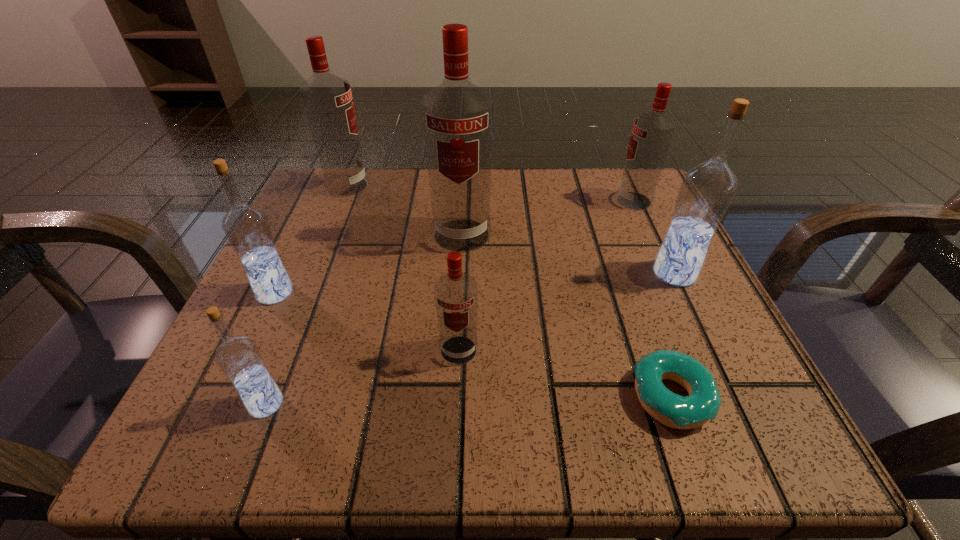
At what (x,y) coordinates should I click in order to perform the action: click on free space that satisfies the following two spatial constraints: 1. on the front label of the rightmost red vodka; 2. on the front label of the sixth nearest object. Please return your answer as a coordinate pair (x, y). The image size is (960, 540). Looking at the image, I should click on (649, 235).

Where is `free space in the image that satisfies the following two spatial constraints: 1. on the front label of the second biggest red vodka; 2. on the front side of the leftmost blue vodka`? Image resolution: width=960 pixels, height=540 pixels. free space in the image that satisfies the following two spatial constraints: 1. on the front label of the second biggest red vodka; 2. on the front side of the leftmost blue vodka is located at coordinates (303, 293).

This screenshot has width=960, height=540. Find the location of `vacant space that satisfies the following two spatial constraints: 1. on the front label of the rightmost red vodka; 2. on the right side of the rightmost blue vodka`. vacant space that satisfies the following two spatial constraints: 1. on the front label of the rightmost red vodka; 2. on the right side of the rightmost blue vodka is located at coordinates (667, 273).

In order to click on free space that satisfies the following two spatial constraints: 1. on the front label of the second biggest red vodka; 2. on the back side of the rightmost blue vodka in this screenshot , I will do `click(311, 273)`.

This screenshot has height=540, width=960. I want to click on vacant region that satisfies the following two spatial constraints: 1. on the front label of the second biggest red vodka; 2. on the left side of the second blue vodka from right to left, so click(257, 403).

The height and width of the screenshot is (540, 960). I want to click on vacant region that satisfies the following two spatial constraints: 1. on the front label of the rightmost red vodka; 2. on the front side of the nearest vodka, so click(x=727, y=403).